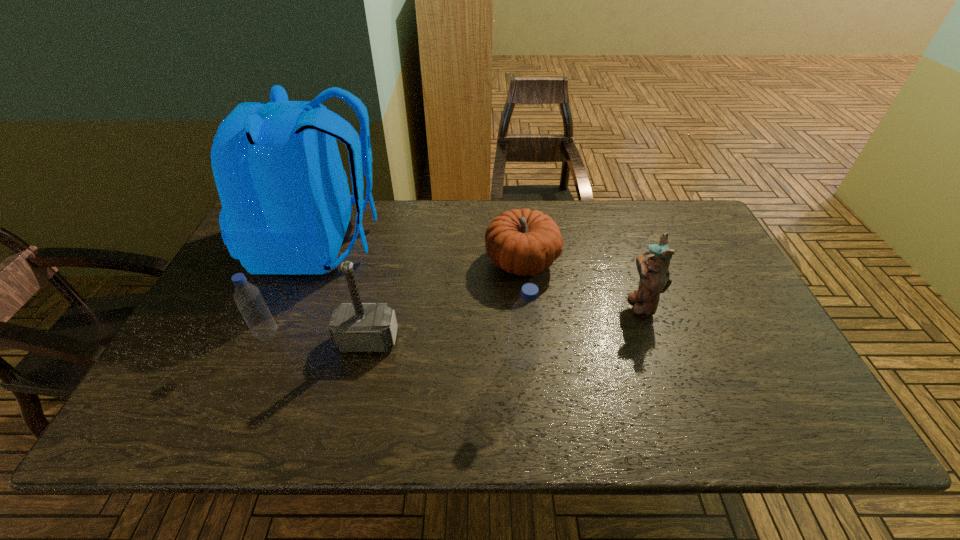
The height and width of the screenshot is (540, 960). In order to click on the left bottle in this screenshot , I will do `click(247, 296)`.

The height and width of the screenshot is (540, 960). I want to click on the shorter bottle, so click(247, 296).

Find the location of a particular element. The height and width of the screenshot is (540, 960). the right bottle is located at coordinates (523, 350).

Locate an element on the screen. the nearer bottle is located at coordinates (523, 350).

Where is `the tallest object`? The height and width of the screenshot is (540, 960). the tallest object is located at coordinates (286, 205).

Where is `the rightmost object`? The height and width of the screenshot is (540, 960). the rightmost object is located at coordinates (653, 267).

In order to click on the shortest object in this screenshot , I will do pyautogui.click(x=523, y=242).

This screenshot has width=960, height=540. Find the location of `hammer`. hammer is located at coordinates (354, 327).

In order to click on free space located 0.230m on the back of the shorter bottle in this screenshot , I will do `click(298, 265)`.

Find the location of a particular element. Image resolution: width=960 pixels, height=540 pixels. free region located 0.230m on the right of the taller bottle is located at coordinates (636, 363).